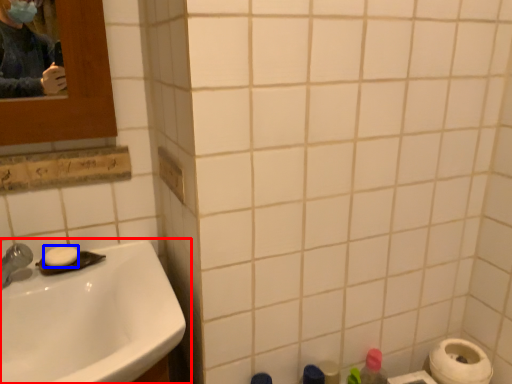
Question: Among these objects, which one is farthest to the camera, sink (highlighted by a red box) or soap (highlighted by a blue box)?

Choices:
 (A) sink
 (B) soap

Answer: (B)